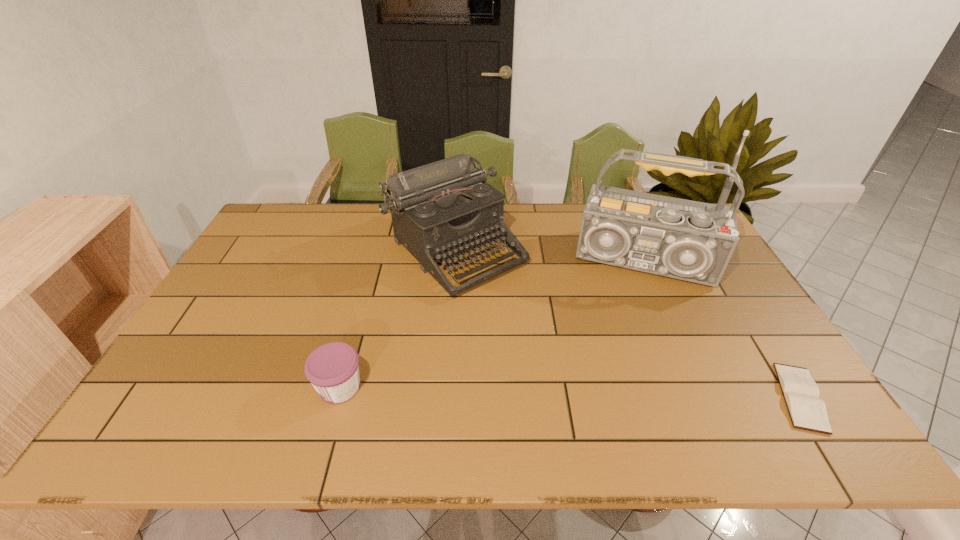
Image resolution: width=960 pixels, height=540 pixels. I want to click on object positioned at the far right corner, so click(x=694, y=241).

Locate an element on the screen. The height and width of the screenshot is (540, 960). object that is at the near right corner is located at coordinates (801, 393).

Where is `free region at the far edge of the desktop`? The image size is (960, 540). free region at the far edge of the desktop is located at coordinates (372, 210).

Where is `blank space at the near edge of the desktop`? This screenshot has width=960, height=540. blank space at the near edge of the desktop is located at coordinates (284, 385).

Where is `vacant region at the far left corner of the desktop`? The width and height of the screenshot is (960, 540). vacant region at the far left corner of the desktop is located at coordinates (275, 212).

In order to click on free space between the shortest object and the tallest object in this screenshot , I will do `click(724, 330)`.

You are a GUI agent. You are given a task and a screenshot of the screen. Output one action in this format:
    pyautogui.click(x=<x>, y=<y>)
    Task: Click on the free spot between the third tallest object and the third shortest object
    
    Given the screenshot: What is the action you would take?
    pyautogui.click(x=397, y=318)

This screenshot has width=960, height=540. What are the coordinates of `vacant area that lies between the tallest object and the second shortest object` in the screenshot? It's located at [493, 325].

At what (x,y) coordinates should I click in order to perform the action: click on free spot between the jam and the shortest object. Please return your answer as a coordinate pair (x, y). Image resolution: width=960 pixels, height=540 pixels. Looking at the image, I should click on (569, 392).

The width and height of the screenshot is (960, 540). What are the coordinates of `free space between the jam and the typewriter` in the screenshot? It's located at (397, 318).